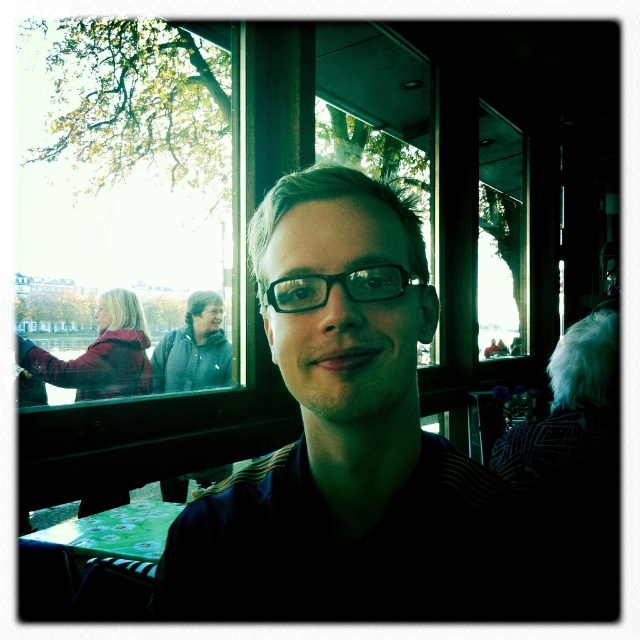
Which of these two, matte black shirt at center or black plastic glasses at center, stands shorter?

With less height is black plastic glasses at center.

Does point (364, 248) lie behind point (353, 289)?

Yes, point (364, 248) is farther from viewer.

Is point (275, 572) farther from viewer compared to point (401, 280)?

Yes, point (275, 572) is behind point (401, 280).

You are a GUI agent. You are given a task and a screenshot of the screen. Output one action in this format:
    pyautogui.click(x=<x>, y=<y>)
    Task: Click on the matte black shirt at center
    The width and height of the screenshot is (640, 640).
    Given the screenshot: What is the action you would take?
    pyautogui.click(x=344, y=440)